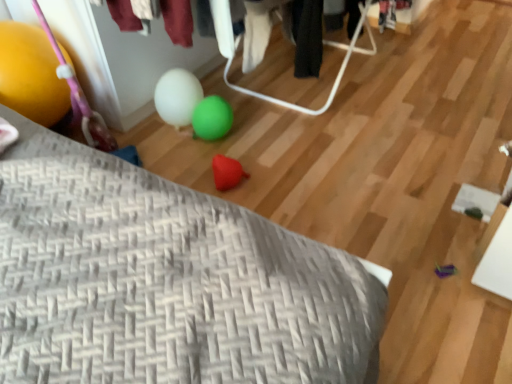
Question: Is gray woven pillow at lower left oriented towards yellow rubber balloon at left?

Choices:
 (A) yes
 (B) no

Answer: (B)

Question: From a real-world perspective, is gray woven pillow at lower left on yellow rubber balloon at left?

Choices:
 (A) yes
 (B) no

Answer: (B)

Question: Is gray woven pillow at lower left beside yellow rubber balloon at left?

Choices:
 (A) no
 (B) yes

Answer: (A)

Question: Would you say gray woven pillow at lower left contains yellow rubber balloon at left?

Choices:
 (A) no
 (B) yes

Answer: (A)

Question: Is gray woven pillow at lower left completely or partially outside of yellow rubber balloon at left?

Choices:
 (A) no
 (B) yes

Answer: (B)

Question: Is gray woven pillow at lower left taller than yellow rubber balloon at left?

Choices:
 (A) no
 (B) yes

Answer: (A)

Question: From the image's perspective, would you say rubber heart at center is shown under yellow rubber balloon at left?

Choices:
 (A) no
 (B) yes

Answer: (B)

Question: Is rubber heart at center bigger than yellow rubber balloon at left?

Choices:
 (A) no
 (B) yes

Answer: (A)

Question: Is rubber heart at center looking in the opposite direction of yellow rubber balloon at left?

Choices:
 (A) yes
 (B) no

Answer: (B)

Question: Does rubber heart at center appear on the left side of yellow rubber balloon at left?

Choices:
 (A) no
 (B) yes

Answer: (A)

Question: Is rubber heart at center completely or partially outside of yellow rubber balloon at left?

Choices:
 (A) no
 (B) yes

Answer: (B)

Question: Is rubber heart at center beside yellow rubber balloon at left?

Choices:
 (A) yes
 (B) no

Answer: (B)

Question: Considering the relative sizes of yellow rubber balloon at left and gray woven pillow at lower left in the image provided, is yellow rubber balloon at left taller than gray woven pillow at lower left?

Choices:
 (A) no
 (B) yes

Answer: (B)